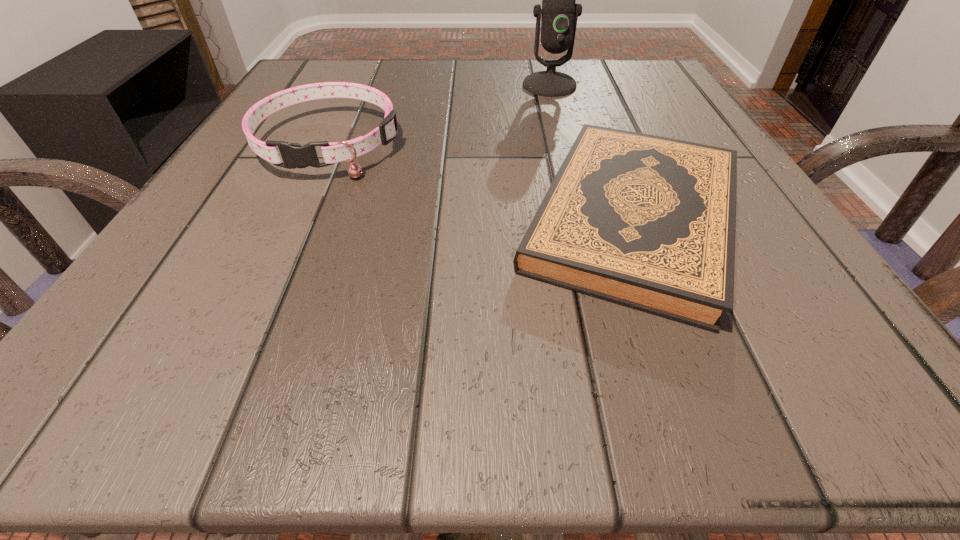
In the image, there is a desktop. Where is `vacant region at the near right corner`? Image resolution: width=960 pixels, height=540 pixels. vacant region at the near right corner is located at coordinates (749, 366).

You are a GUI agent. You are given a task and a screenshot of the screen. Output one action in this format:
    pyautogui.click(x=<x>, y=<y>)
    Task: Click on the vacant space that is in between the farthest object and the second shortest object
    
    Given the screenshot: What is the action you would take?
    pyautogui.click(x=440, y=114)

This screenshot has height=540, width=960. I want to click on empty space between the second shortest object and the microphone, so click(440, 114).

You are a GUI agent. You are given a task and a screenshot of the screen. Output one action in this format:
    pyautogui.click(x=<x>, y=<y>)
    Task: Click on the vacant region between the second shortest object and the shortest object
    
    Given the screenshot: What is the action you would take?
    pyautogui.click(x=481, y=180)

What are the coordinates of `empty location between the leftmost object and the hardback book` in the screenshot? It's located at (481, 180).

Identify the location of vacant area between the leftmost object and the hardback book. Image resolution: width=960 pixels, height=540 pixels. (481, 180).

Point out which object is positioned as the second nearest to the farthest object. Please provide its 2D coordinates. Your answer should be formatted as a tuple, i.e. [(x, y)], where the tuple contains the x and y coordinates of a point satisfying the conditions above.

[(293, 155)]

Locate an element on the screen. object that can be found as the second closest to the second tallest object is located at coordinates (558, 22).

Identify the location of blank space that satisfies the following two spatial constraints: 1. with the buckle on the shortest object; 2. on the right side of the dog collar. (295, 218).

The width and height of the screenshot is (960, 540). Identify the location of free space that satisfies the following two spatial constraints: 1. with the buckle on the shortest object; 2. on the left side of the dog collar. (295, 218).